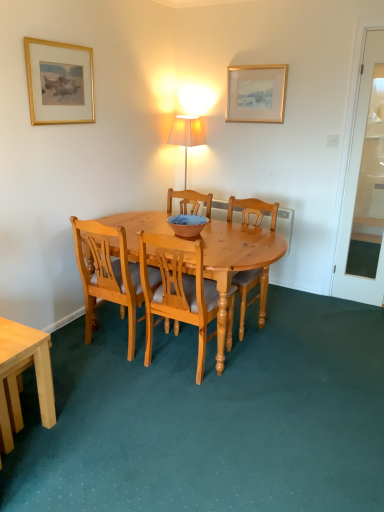
Question: Looking at their shapes, would you say light brown wood chair at center, the third chair in the right-to-left sequence, is wider or thinner than light brown wooden chair at center, arranged as the third chair when viewed from the left?

Choices:
 (A) thin
 (B) wide

Answer: (A)

Question: Is light brown wood chair at center, the third chair in the right-to-left sequence, to the left or to the right of light brown wooden chair at center, arranged as the third chair when viewed from the left, in the image?

Choices:
 (A) left
 (B) right

Answer: (A)

Question: Which is nearer to the light brown wood chair at center, which is counted as the 1th chair, starting from the left?

Choices:
 (A) gold-framed picture at upper left, which is counted as the second picture frame, starting from the back
 (B) gold framed picture at upper center, marked as the first picture frame in a right-to-left arrangement
 (C) light brown wooden chair at center, arranged as the third chair when viewed from the left
 (D) light wood chair at center, which is the 2th chair in right-to-left order
 (E) blue and white ceramic bowl at center

Answer: (D)

Question: Which object is the farthest from the gold framed picture at upper center, the first picture frame viewed from the back?

Choices:
 (A) light wood chair at center, which is the 2th chair in right-to-left order
 (B) blue and white ceramic bowl at center
 (C) gold-framed picture at upper left, the 2th picture frame in the right-to-left sequence
 (D) light brown wooden chair at center, positioned as the 1th chair in right-to-left order
 (E) light brown wood chair at center, the third chair in the right-to-left sequence

Answer: (E)